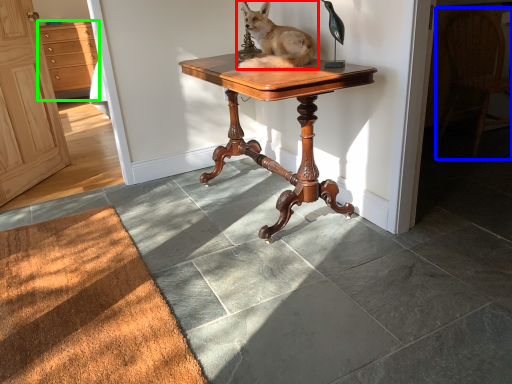
Question: Based on their relative distances, which object is nearer to dog (highlighted by a red box)? Choose from chair (highlighted by a blue box) and cabinetry (highlighted by a green box).

Choices:
 (A) chair
 (B) cabinetry

Answer: (A)